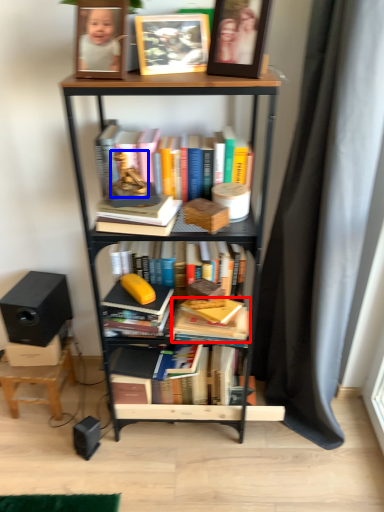
Question: Which object is closer to the camera taking this photo, book (highlighted by a red box) or toy (highlighted by a blue box)?

Choices:
 (A) book
 (B) toy

Answer: (B)